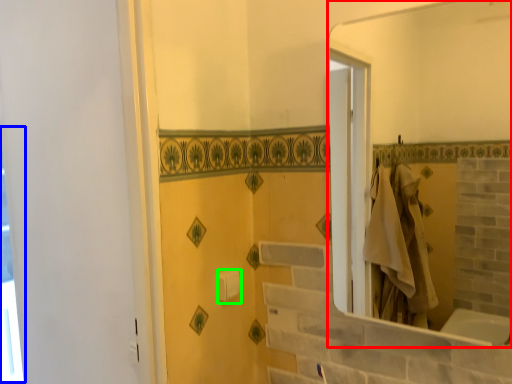
Question: Which object is positioned closest to mirror (highlighted by a red box)? Select from window (highlighted by a blue box) and towel bar (highlighted by a green box).

Choices:
 (A) window
 (B) towel bar

Answer: (B)